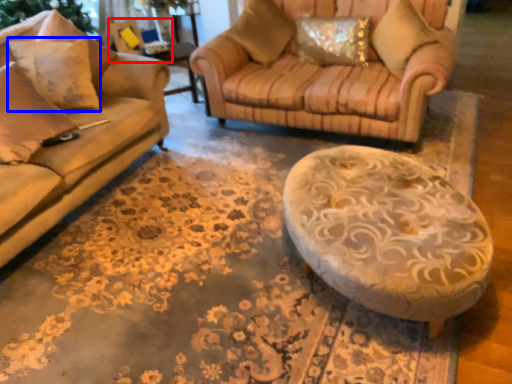
Question: Which of the following is the closest to the observer, swivel chair (highlighted by a red box) or pillow (highlighted by a blue box)?

Choices:
 (A) swivel chair
 (B) pillow

Answer: (B)